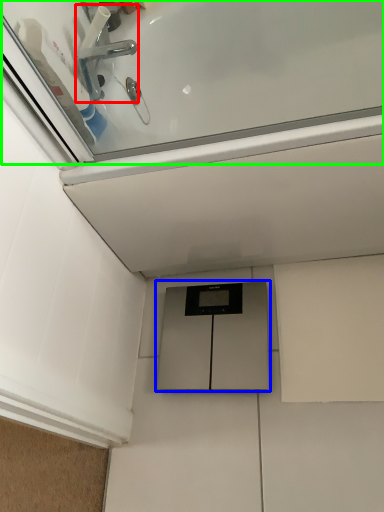
Question: Estimate the real-world distances between objects in this image. Which object is farther from tap (highlighted by a red box), cabinetry (highlighted by a blue box) or bath (highlighted by a green box)?

Choices:
 (A) cabinetry
 (B) bath

Answer: (A)